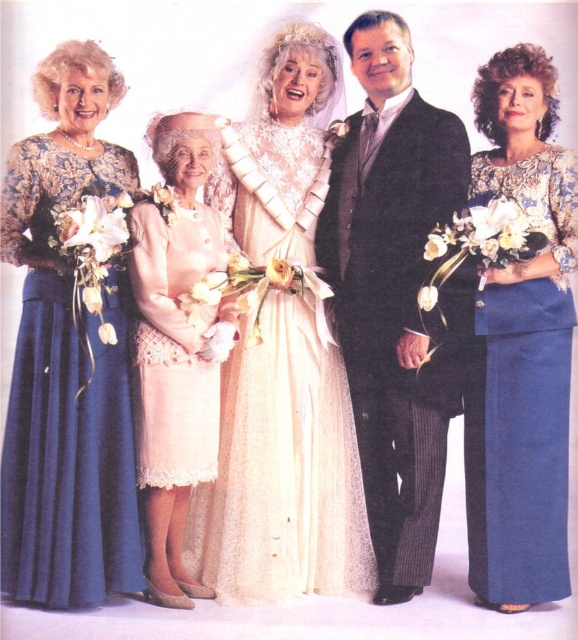
You are a photographer adjusting the focus on your camera. You notice two points in the image at coordinates point [360,364] and point [61,385]. Which point should you focus on first to ensure the subject closest to the camera is sharp?

Point [360,364] is further to the camera than point [61,385], so you should focus on point [360,364] first to ensure the subject closest to the camera is sharp.

You are a photographer trying to adjust the lighting for a photo shoot. You notice the matte blue dress at left and the dark gray pinstripe suit at center. Which one is positioned farther away from the camera?

The matte blue dress at left is behind the dark gray pinstripe suit at center, so it is farther away from the camera.

You are a photographer setting up for a photoshoot. You need to position a light source so that it illuminates both the matte blue dress at left and the blue satin dress at right without causing glare on either. Given their positions and the lighting properties of their materials, which dress should be placed closer to the light source to achieve even illumination?

The matte blue dress at left should be placed closer to the light source because matte surfaces require more direct light to achieve the same level of illumination as satin, which reflects light more efficiently. Since the matte blue dress at left is above the blue satin dress at right, positioning it closer ensures both dresses are evenly lit without glare.